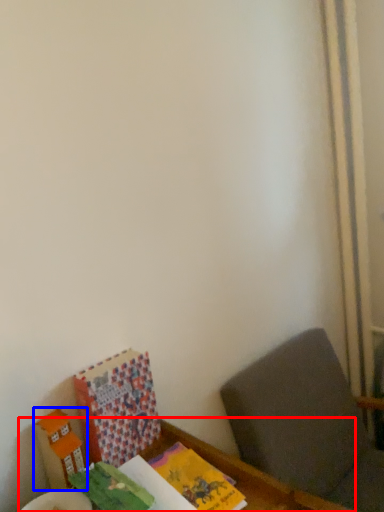
Question: Among these objects, which one is nearest to the camera, table (highlighted by a red box) or cardboard box (highlighted by a blue box)?

Choices:
 (A) table
 (B) cardboard box

Answer: (A)